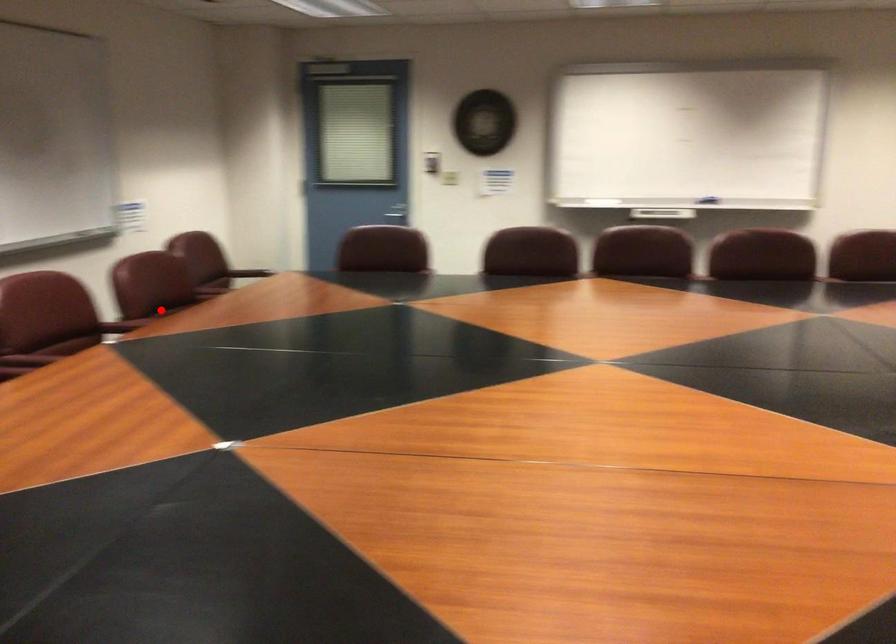
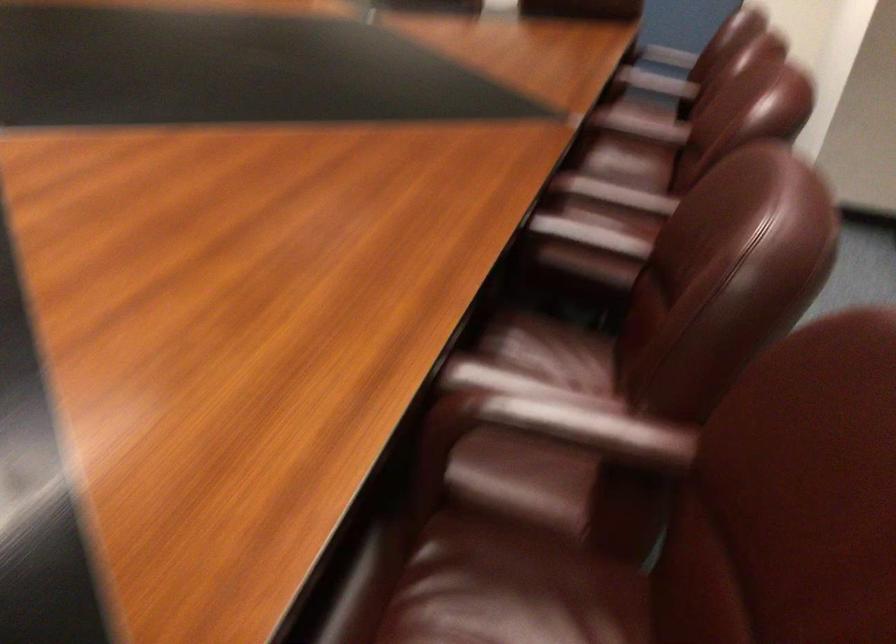
In the second image, find the point that corresponds to the highlighted location in the first image.

(590, 247)